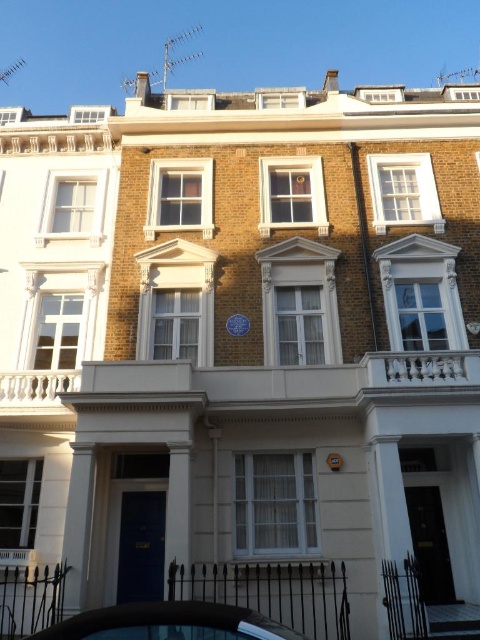
Who is more forward, (x=212, y=620) or (x=334, y=465)?

Point (x=212, y=620) is more forward.

Is shiny black car at lower center bigger than yellow plastic clock at center?

Yes.

Locate an element on the screen. Image resolution: width=480 pixels, height=640 pixels. shiny black car at lower center is located at coordinates (x=168, y=624).